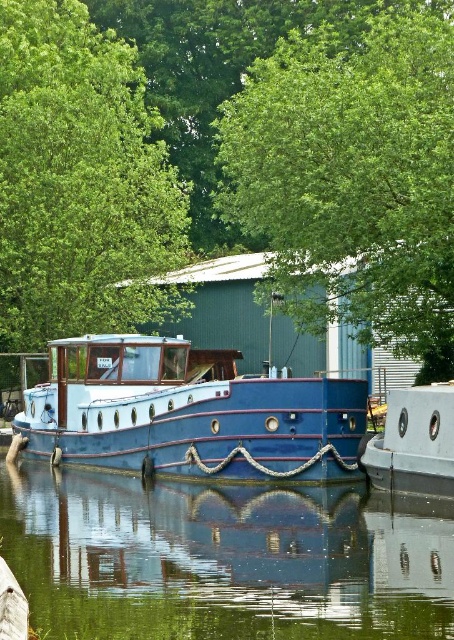
Is green leafy tree at upper center below metallic blue boat at center?

No.

Locate an element on the screen. green leafy tree at upper center is located at coordinates (353, 177).

Does point (358, 554) come in front of point (50, 280)?

Yes, it is in front of point (50, 280).

Which is behind, point (153, 566) or point (34, 17)?

The point (34, 17) is behind.

This screenshot has height=640, width=454. Find the location of `transparent glass water at center`. transparent glass water at center is located at coordinates (222, 560).

What are the coordinates of `transparent glass water at center` in the screenshot? It's located at (222, 560).

Does transparent glass water at center appear on the right side of metallic blue boat at center?

No, transparent glass water at center is not to the right of metallic blue boat at center.

Is transparent glass water at center below metallic blue boat at center?

Indeed, transparent glass water at center is positioned under metallic blue boat at center.

Which is in front, point (440, 595) or point (419, 483)?

Point (440, 595) is more forward.

Image resolution: width=454 pixels, height=640 pixels. What are the coordinates of `transparent glass water at center` in the screenshot? It's located at (222, 560).